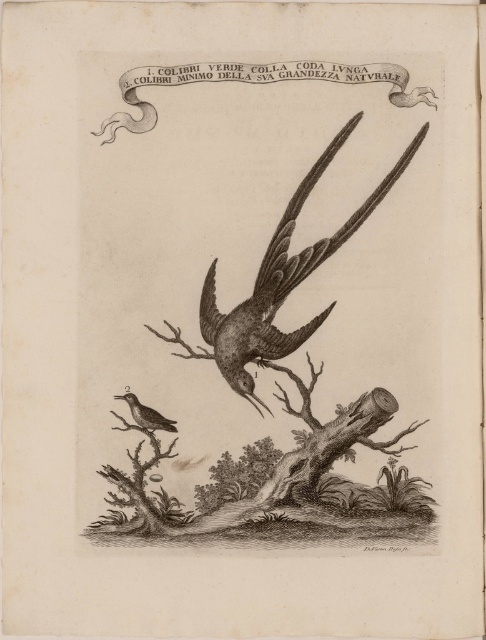
You are an ornithologist examining this engraving. You notice the smooth wood tree trunk at lower center and the brown wood grain bird at lower left. Which object appears taller in the engraving?

The smooth wood tree trunk at lower center is taller than the brown wood grain bird at lower left according to the engraving details.

You are an ornithologist examining this engraving. You need to determine the spatial relationship between the smooth wood tree trunk at lower center and the gray textured bird at center. Which object is positioned closer to the viewer?

The smooth wood tree trunk at lower center is closer to the viewer than the gray textured bird at center.

You are an ornithologist observing the scene. You need to determine which object is wider between the smooth wood tree trunk at lower center and the gray textured bird at center. Which one is wider?

The smooth wood tree trunk at lower center is wider than the gray textured bird at center according to the description.